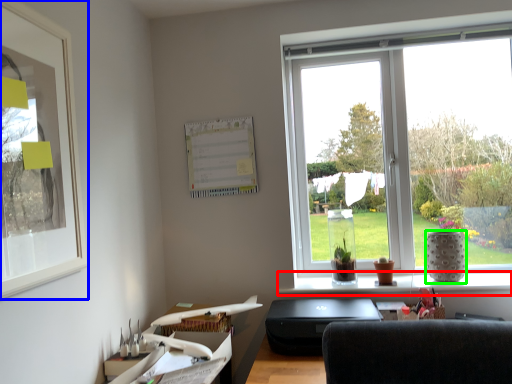
Question: Which is farther away from window sill (highlighted by a red box)? picture frame (highlighted by a blue box) or vase (highlighted by a green box)?

Choices:
 (A) picture frame
 (B) vase

Answer: (A)